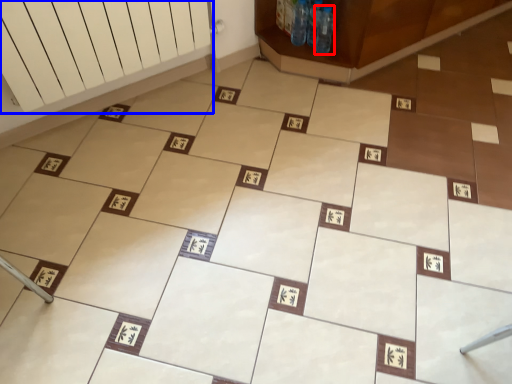
Question: Among these objects, which one is nearest to the camera, bottle (highlighted by a red box) or radiator (highlighted by a blue box)?

Choices:
 (A) bottle
 (B) radiator

Answer: (B)